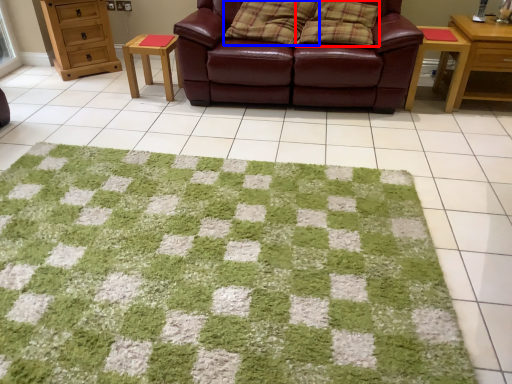
Question: Which object appears farthest to the camera in this image, pillow (highlighted by a red box) or pillow (highlighted by a blue box)?

Choices:
 (A) pillow
 (B) pillow

Answer: (B)